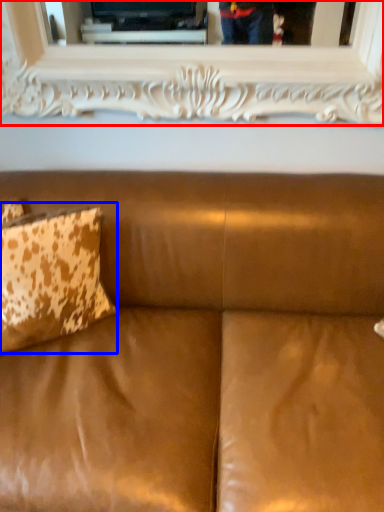
Question: Which point is further to the camera, picture frame (highlighted by a red box) or pillow (highlighted by a blue box)?

Choices:
 (A) picture frame
 (B) pillow

Answer: (A)